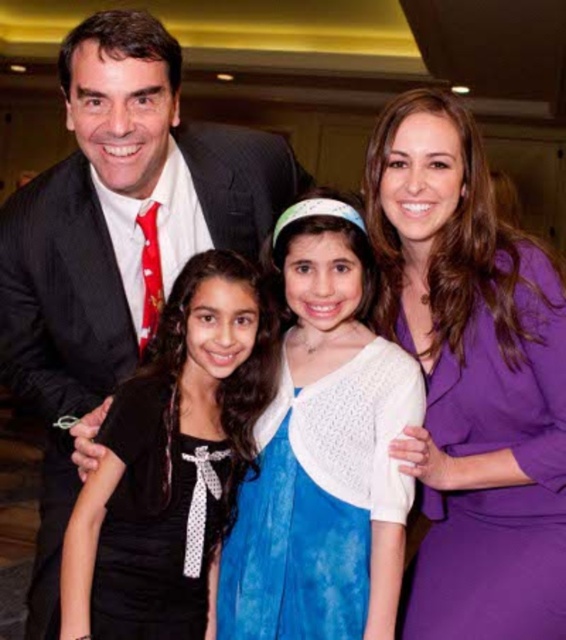
Question: Is purple satin dress at right bigger than black satin dress at center?

Choices:
 (A) no
 (B) yes

Answer: (B)

Question: Can you confirm if black satin dress at center is positioned above blue tie-dye dress at center?

Choices:
 (A) yes
 (B) no

Answer: (A)

Question: Observing the image, what is the correct spatial positioning of purple satin dress at right in reference to matte black suit at left?

Choices:
 (A) below
 (B) above

Answer: (A)

Question: Which object is positioned farthest from the blue tie-dye dress at center?

Choices:
 (A) black satin dress at center
 (B) matte black suit at left

Answer: (B)

Question: Which object is closer to the camera taking this photo?

Choices:
 (A) purple satin dress at right
 (B) blue tie-dye dress at center
 (C) matte black suit at left
 (D) black satin dress at center

Answer: (C)

Question: Which of the following is the closest to the observer?

Choices:
 (A) black satin dress at center
 (B) purple satin dress at right
 (C) blue tie-dye dress at center

Answer: (B)